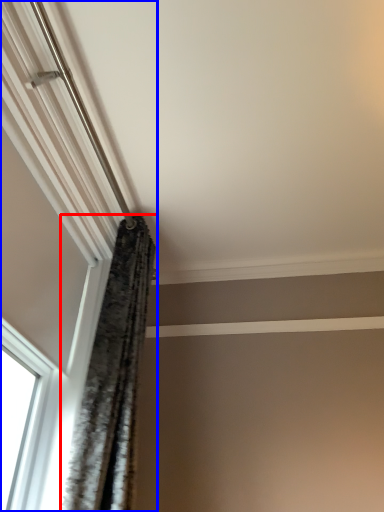
Question: Among these objects, which one is nearest to the camera, curtain (highlighted by a red box) or window (highlighted by a blue box)?

Choices:
 (A) curtain
 (B) window

Answer: (B)